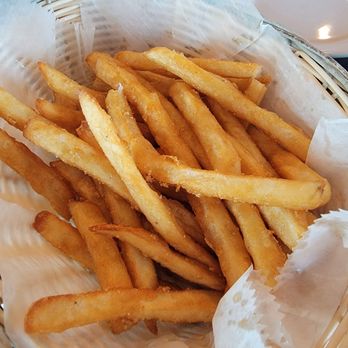
Locate an element on the screen. wall is located at coordinates (341, 49).